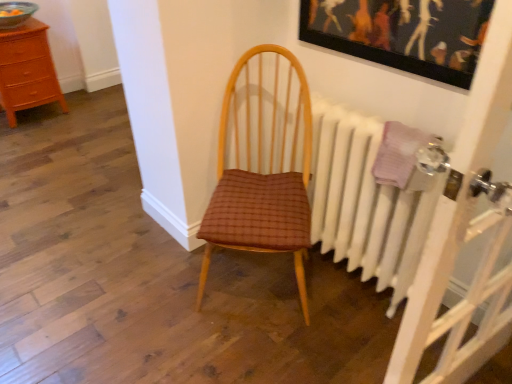
At what (x,y) coordinates should I click in order to perform the action: click on wooden picture frame at upper center. Please return your answer as a coordinate pair (x, y). This screenshot has width=512, height=384. Looking at the image, I should click on (403, 33).

What are the coordinates of `wooden chest of drawers at left` in the screenshot? It's located at (27, 70).

How far apart are wooden picture frame at upper center and white painted radiator at right?

The distance of wooden picture frame at upper center from white painted radiator at right is 19.11 inches.

From a real-world perspective, is wooden picture frame at upper center on white painted radiator at right?

Yes, from a real-world perspective, wooden picture frame at upper center is over white painted radiator at right

Does point (349, 18) lie behind point (345, 171)?

No, (349, 18) is closer to viewer.

Does point (285, 132) lie behind point (458, 75)?

Yes.

In the scene shown: Would you consider brown woven fabric chair at center to be distant from wooden picture frame at upper center?

They are positioned close to each other.

Who is smaller, brown woven fabric chair at center or wooden picture frame at upper center?

wooden picture frame at upper center is smaller.

Looking at their sizes, would you say white painted radiator at right is wider or thinner than wooden picture frame at upper center?

In the image, white painted radiator at right appears to be wider than wooden picture frame at upper center.

Locate an element on the screen. The image size is (512, 384). radiator that is on the left side of wooden picture frame at upper center is located at coordinates (365, 203).

Is white painted radiator at right not inside wooden picture frame at upper center?

Absolutely, white painted radiator at right is external to wooden picture frame at upper center.

Is point (246, 239) positioned after point (414, 190)?

That is True.

Are brown woven fabric chair at center and white painted radiator at right located far from each other?

No, brown woven fabric chair at center is not far away from white painted radiator at right.

Does brown woven fabric chair at center contain white painted radiator at right?

No, white painted radiator at right is not surrounded by brown woven fabric chair at center.

How many degrees apart are the facing directions of brown woven fabric chair at center and white painted radiator at right?

There is a 39.9-degree angle between the facing directions of brown woven fabric chair at center and white painted radiator at right.

Is brown woven fabric chair at center taller or shorter than wooden chest of drawers at left?

brown woven fabric chair at center is taller than wooden chest of drawers at left.

Is brown woven fabric chair at center beside wooden chest of drawers at left?

No, brown woven fabric chair at center is not with wooden chest of drawers at left.

Consider the image. What's the angular difference between brown woven fabric chair at center and wooden chest of drawers at left's facing directions?

They differ by 50.4 degrees in their facing directions.

From the image's perspective, relative to wooden chest of drawers at left, is brown woven fabric chair at center above or below?

brown woven fabric chair at center is below wooden chest of drawers at left.

Is the surface of wooden chest of drawers at left in direct contact with brown woven fabric chair at center?

No, wooden chest of drawers at left is not touching brown woven fabric chair at center.

Considering the relative sizes of wooden chest of drawers at left and brown woven fabric chair at center in the image provided, is wooden chest of drawers at left smaller than brown woven fabric chair at center?

Correct, wooden chest of drawers at left occupies less space than brown woven fabric chair at center.

Is wooden picture frame at upper center smaller than brown woven fabric chair at center?

Yes, wooden picture frame at upper center is smaller than brown woven fabric chair at center.

From the image's perspective, which one is positioned lower, wooden picture frame at upper center or brown woven fabric chair at center?

From the image's view, brown woven fabric chair at center is below.

How different are the orientations of wooden picture frame at upper center and brown woven fabric chair at center in degrees?

The angle between the facing direction of wooden picture frame at upper center and the facing direction of brown woven fabric chair at center is 40.4 degrees.

The height and width of the screenshot is (384, 512). Find the location of `radiator behind the wooden picture frame at upper center`. radiator behind the wooden picture frame at upper center is located at coordinates pyautogui.click(x=365, y=203).

Locate an element on the screen. This screenshot has width=512, height=384. chair that is on the left side of wooden picture frame at upper center is located at coordinates (263, 165).

Estimate the real-world distances between objects in this image. Which object is closer to brown woven fabric chair at center, wooden chest of drawers at left or white painted radiator at right?

Based on the image, white painted radiator at right appears to be nearer to brown woven fabric chair at center.

Estimate the real-world distances between objects in this image. Which object is closer to wooden picture frame at upper center, brown woven fabric chair at center or white painted radiator at right?

white painted radiator at right lies closer to wooden picture frame at upper center than the other object.

From the picture: From the image, which object appears to be farther from wooden chest of drawers at left, wooden picture frame at upper center or brown woven fabric chair at center?

Among the two, wooden picture frame at upper center is located further to wooden chest of drawers at left.

Looking at the image, which one is located closer to wooden picture frame at upper center, wooden chest of drawers at left or brown woven fabric chair at center?

brown woven fabric chair at center is closer to wooden picture frame at upper center.

Which object lies further to the anchor point brown woven fabric chair at center, wooden picture frame at upper center or wooden chest of drawers at left?

wooden chest of drawers at left is further to brown woven fabric chair at center.

Looking at the image, which one is located further to wooden picture frame at upper center, white painted radiator at right or wooden chest of drawers at left?

wooden chest of drawers at left is positioned further to the anchor wooden picture frame at upper center.

Estimate the real-world distances between objects in this image. Which object is closer to wooden picture frame at upper center, wooden chest of drawers at left or white painted radiator at right?

Based on the image, white painted radiator at right appears to be nearer to wooden picture frame at upper center.

Consider the image. Considering their positions, is wooden chest of drawers at left positioned further to white painted radiator at right than brown woven fabric chair at center?

Based on the image, wooden chest of drawers at left appears to be further to white painted radiator at right.

Where is `chair between wooden chest of drawers at left and white painted radiator at right from left to right`? The height and width of the screenshot is (384, 512). chair between wooden chest of drawers at left and white painted radiator at right from left to right is located at coordinates (263, 165).

You are a GUI agent. You are given a task and a screenshot of the screen. Output one action in this format:
    pyautogui.click(x=<x>, y=<y>)
    Task: Click on the radiator situated between wooden chest of drawers at left and wooden picture frame at upper center from left to right
    The height and width of the screenshot is (384, 512).
    Given the screenshot: What is the action you would take?
    pyautogui.click(x=365, y=203)

The width and height of the screenshot is (512, 384). Find the location of `chair situated between wooden chest of drawers at left and wooden picture frame at upper center from left to right`. chair situated between wooden chest of drawers at left and wooden picture frame at upper center from left to right is located at coordinates (263, 165).

Where is `chair between wooden picture frame at upper center and white painted radiator at right from top to bottom`? chair between wooden picture frame at upper center and white painted radiator at right from top to bottom is located at coordinates (263, 165).